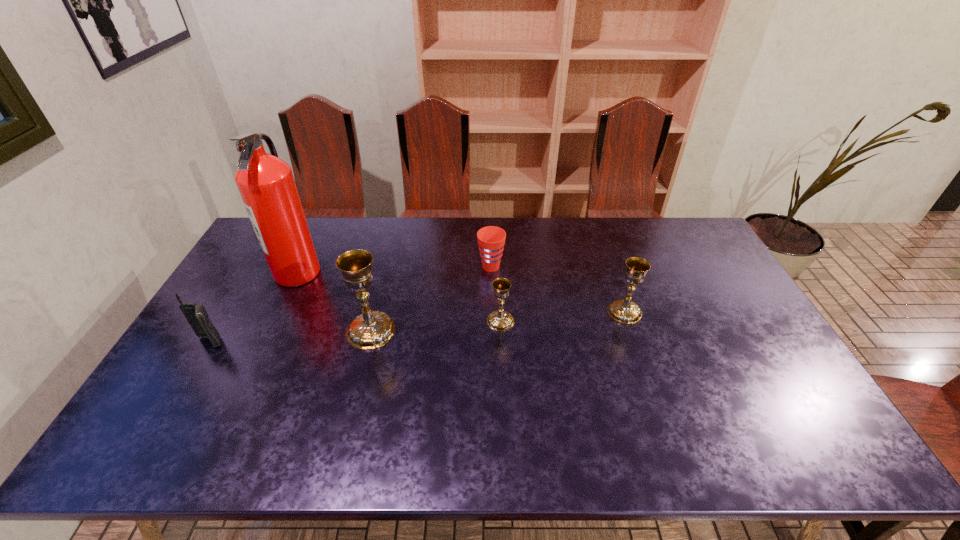
In the image, there is a desktop. Where is `vacant space at the near edge`? This screenshot has width=960, height=540. vacant space at the near edge is located at coordinates (360, 403).

Locate an element on the screen. The image size is (960, 540). vacant point at the right edge is located at coordinates (715, 289).

Locate an element on the screen. The width and height of the screenshot is (960, 540). vacant region at the near right corner of the desktop is located at coordinates (765, 406).

Locate an element on the screen. The height and width of the screenshot is (540, 960). blank region between the fire extinguisher and the cup is located at coordinates [x=395, y=269].

Find the location of `free spot between the second object from left to right and the leftmost chalice`. free spot between the second object from left to right and the leftmost chalice is located at coordinates (334, 301).

Find the location of `empty space that is in between the leftmost chalice and the second object from left to right`. empty space that is in between the leftmost chalice and the second object from left to right is located at coordinates (334, 301).

The height and width of the screenshot is (540, 960). What are the coordinates of `vacant region between the rightmost chalice and the fire extinguisher` in the screenshot? It's located at (461, 292).

This screenshot has height=540, width=960. What are the coordinates of `unoccupied area between the cellular telephone and the fourth object from right to left` in the screenshot? It's located at (291, 336).

At what (x,y) coordinates should I click in order to perform the action: click on vacant area between the fire extinguisher and the rightmost object. Please return your answer as a coordinate pair (x, y). Looking at the image, I should click on (461, 292).

Locate an element on the screen. This screenshot has height=540, width=960. vacant area that lies between the rightmost object and the cup is located at coordinates (558, 289).